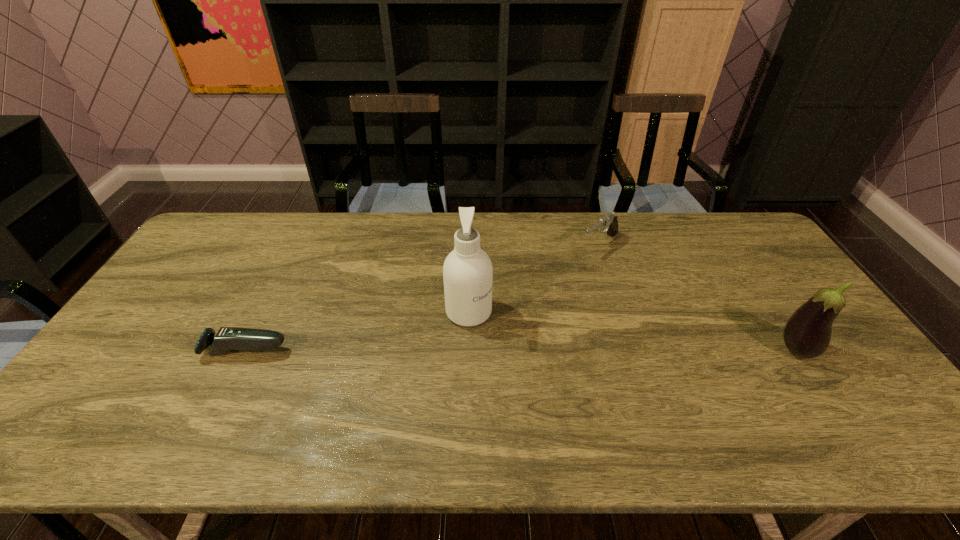
Locate an element on the screen. the shortest object is located at coordinates (227, 338).

The height and width of the screenshot is (540, 960). I want to click on electric shaver, so click(x=227, y=338).

Identify the location of eggplant. (807, 333).

Where is `the rightmost object`? This screenshot has width=960, height=540. the rightmost object is located at coordinates (807, 333).

The image size is (960, 540). I want to click on the third object from left to right, so click(609, 221).

Where is `the third tallest object`? This screenshot has height=540, width=960. the third tallest object is located at coordinates (x=609, y=221).

Locate an element on the screen. The height and width of the screenshot is (540, 960). the tallest object is located at coordinates (467, 271).

Identify the location of cleansing agent. The height and width of the screenshot is (540, 960). (467, 271).

Where is `blank space located on the head of the electric shaver`? The height and width of the screenshot is (540, 960). blank space located on the head of the electric shaver is located at coordinates (121, 350).

In order to click on free space located 0.140m on the head of the electric shaver in this screenshot , I will do `click(151, 350)`.